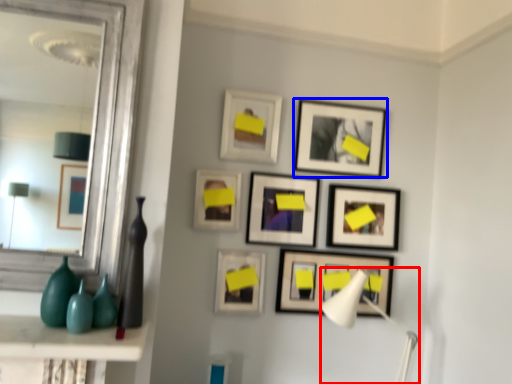
Question: Which point is further to the camera, table lamp (highlighted by a red box) or picture frame (highlighted by a blue box)?

Choices:
 (A) table lamp
 (B) picture frame

Answer: (B)